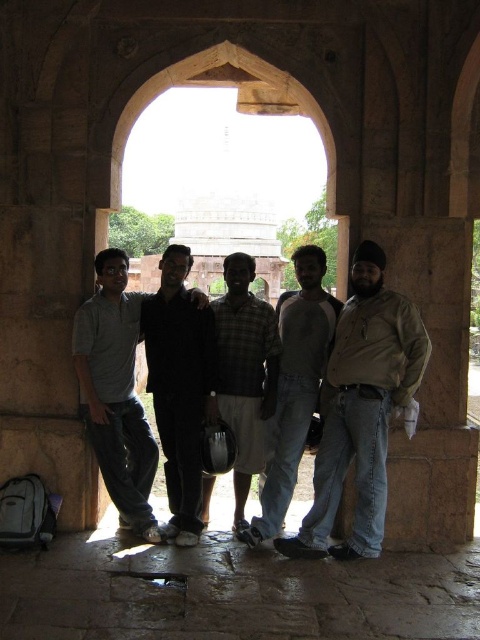
Based on the photo, looking at the two people in the center of the image, the one wearing a brown leather jacket at center and the other in a dark gray cotton shirt at center, which one is positioned to the right?

The brown leather jacket at center is positioned to the right of the dark gray cotton shirt at center.

You are a photographer trying to capture a photo of the dark gray jeans at center and the dark gray cotton shirt at center. Which one should you focus on first if you want to ensure both are in focus, considering their heights?

The dark gray jeans at center has a lesser height compared to dark gray cotton shirt at center, so you should focus on the dark gray cotton shirt at center first to ensure both are in focus.

You are a photographer trying to capture a clear shot of the checkered fabric shirt at center and the light gray cotton pants at center. Which item is located lower on the person?

The light gray cotton pants at center is positioned under the checkered fabric shirt at center, so it is located lower on the person.